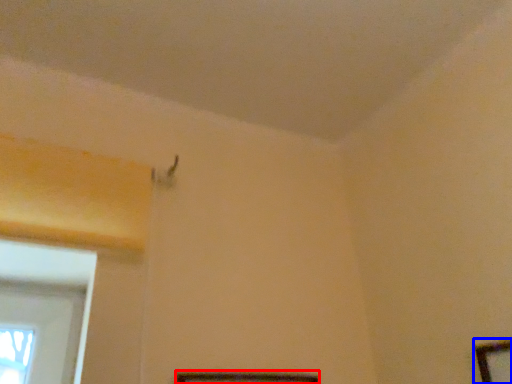
Question: Among these objects, which one is nearest to the camera, picture frame (highlighted by a red box) or picture frame (highlighted by a blue box)?

Choices:
 (A) picture frame
 (B) picture frame

Answer: (B)